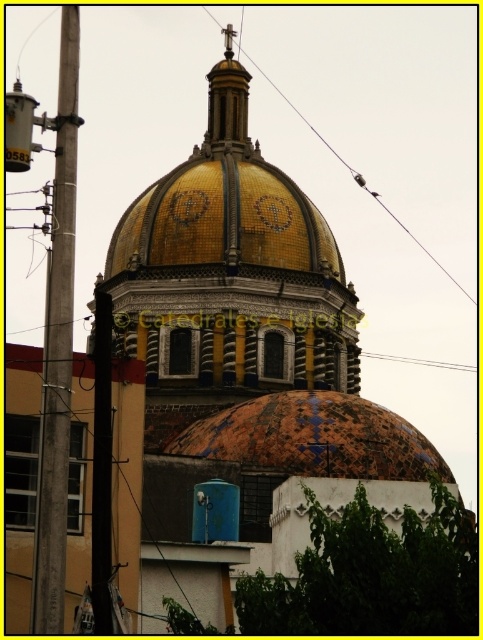
Question: In this image, where is gold mosaic dome at center located relative to gray concrete pole at left?

Choices:
 (A) right
 (B) left

Answer: (A)

Question: Estimate the real-world distances between objects in this image. Which object is closer to the gold mosaic dome at center?

Choices:
 (A) rusty ceramic dome at center
 (B) gray concrete pole at left
 (C) metallic wire at upper center

Answer: (A)

Question: Does gray concrete pole at left have a smaller size compared to metallic wire at upper center?

Choices:
 (A) no
 (B) yes

Answer: (B)

Question: Where is gold mosaic dome at center located in relation to metallic wire at upper center in the image?

Choices:
 (A) below
 (B) above

Answer: (A)

Question: Which object is farther from the camera taking this photo?

Choices:
 (A) gray concrete pole at left
 (B) metallic wire at upper center
 (C) rusty ceramic dome at center
 (D) gold mosaic dome at center

Answer: (B)

Question: Which of the following is the closest to the observer?

Choices:
 (A) metallic wire at upper center
 (B) gold mosaic dome at center
 (C) gray concrete pole at left

Answer: (C)